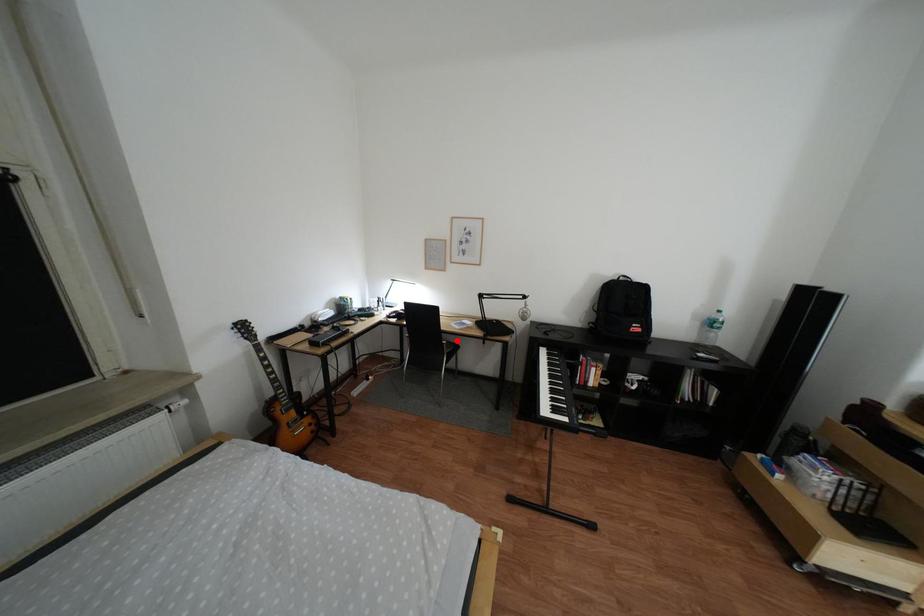
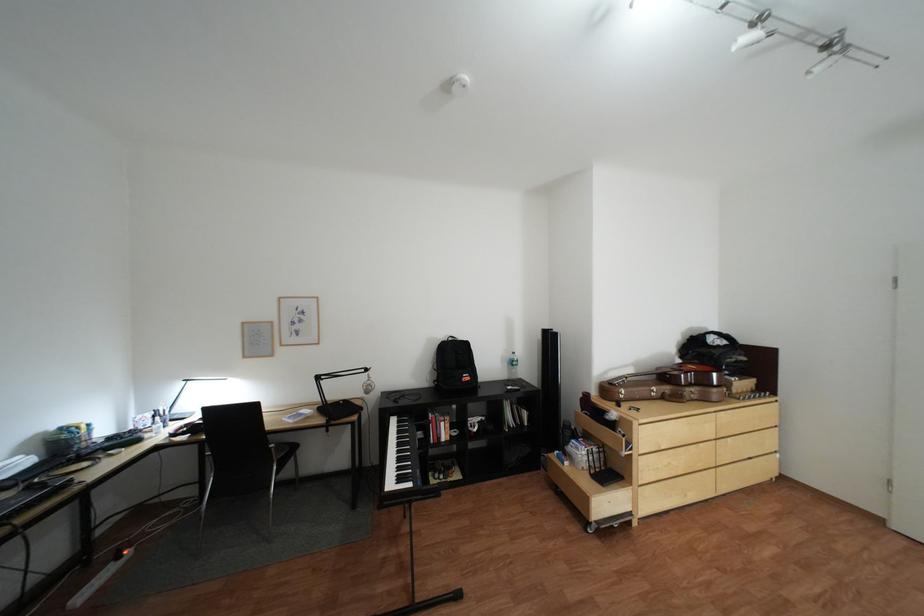
Find the pixel in the second image that matches the highlighted location in the first image.

(284, 445)